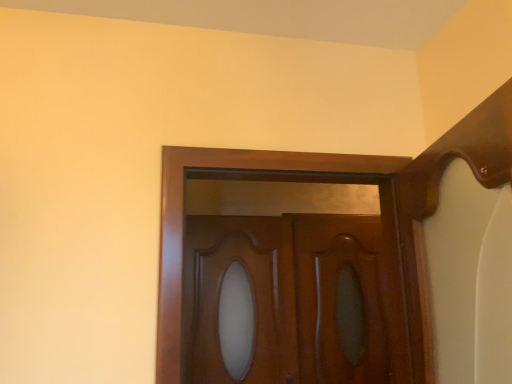
The width and height of the screenshot is (512, 384). I want to click on glossy wood door at center, so pos(250,293).

Measure the distance between point (355,379) and camera.

Point (355,379) and camera are 2.72 meters apart from each other.

Image resolution: width=512 pixels, height=384 pixels. I want to click on glossy wood door at center, so click(293, 298).

The height and width of the screenshot is (384, 512). In order to click on glossy wood door at center in this screenshot , I will do `click(250, 293)`.

Is glossy wood door at center positioned with its back to glossy wood door at center?

No, glossy wood door at center is not facing the opposite direction of glossy wood door at center.

From a real-world perspective, is glossy wood door at center above or below glossy wood door at center?

glossy wood door at center is situated lower than glossy wood door at center in the real world.

Does glossy wood door at center have a smaller size compared to glossy wood door at center?

Yes.

Is glossy wood door at center bigger than glossy wood screen door at center?

Yes.

Which object is closer to the camera taking this photo, glossy wood door at center or glossy wood screen door at center?

Positioned in front is glossy wood door at center.

Is glossy wood door at center beside glossy wood screen door at center?

They are not placed beside each other.

Who is taller, glossy wood door at center or glossy wood screen door at center?

Standing taller between the two is glossy wood screen door at center.

Which of these two, glossy wood door at center or glossy wood screen door at center, is thinner?

glossy wood screen door at center is thinner.

Is glossy wood door at center not within glossy wood screen door at center?

Indeed, glossy wood door at center is completely outside glossy wood screen door at center.

Measure the distance between glossy wood door at center and glossy wood screen door at center.

They are 3.41 inches apart.

Considering the sizes of objects glossy wood door at center and glossy wood door at center in the image provided, who is shorter, glossy wood door at center or glossy wood door at center?

glossy wood door at center is shorter.

Is glossy wood door at center bigger or smaller than glossy wood door at center?

In the image, glossy wood door at center appears to be larger than glossy wood door at center.

Can you confirm if glossy wood door at center is positioned to the left of glossy wood door at center?

No.

Is glossy wood door at center a part of glossy wood screen door at center?

No, glossy wood door at center is not a part of glossy wood screen door at center.

Looking at this image, is glossy wood screen door at center behind glossy wood door at center?

Yes, it is behind glossy wood door at center.

Is point (353, 303) less distant than point (270, 330)?

No, (353, 303) is behind (270, 330).

Would you say glossy wood screen door at center is a long distance from glossy wood door at center?

They are positioned close to each other.

From a real-world perspective, which is physically above, glossy wood screen door at center or glossy wood door at center?

From a 3D spatial view, glossy wood door at center is above.

From the image's perspective, is glossy wood screen door at center above glossy wood door at center?

No, from the image's perspective, glossy wood screen door at center is not on top of glossy wood door at center.

Which point is more distant from viewer, (x=334, y=288) or (x=182, y=375)?

The point (x=334, y=288) is more distant.

Identify the location of door in front of the glossy wood door at center. (293, 298).

Find the location of a particular element. screen door behind the glossy wood door at center is located at coordinates (341, 299).

From the image, which object appears to be nearer to glossy wood door at center, glossy wood door at center or glossy wood screen door at center?

glossy wood door at center lies closer to glossy wood door at center than the other object.

Which object lies further to the anchor point glossy wood screen door at center, glossy wood door at center or glossy wood door at center?

Among the two, glossy wood door at center is located further to glossy wood screen door at center.

From the image, which object appears to be farther from glossy wood door at center, glossy wood door at center or glossy wood screen door at center?

glossy wood door at center.

Looking at the image, which one is located further to glossy wood door at center, glossy wood screen door at center or glossy wood door at center?

glossy wood screen door at center lies further to glossy wood door at center than the other object.

Looking at this image, when comparing their distances from glossy wood screen door at center, does glossy wood door at center or glossy wood door at center seem closer?

The object closer to glossy wood screen door at center is glossy wood door at center.

Looking at the image, which one is located closer to glossy wood door at center, glossy wood screen door at center or glossy wood door at center?

glossy wood screen door at center is positioned closer to the anchor glossy wood door at center.

This screenshot has height=384, width=512. Find the location of `cabinetry between glossy wood door at center and glossy wood screen door at center in the front-back direction`. cabinetry between glossy wood door at center and glossy wood screen door at center in the front-back direction is located at coordinates (250, 293).